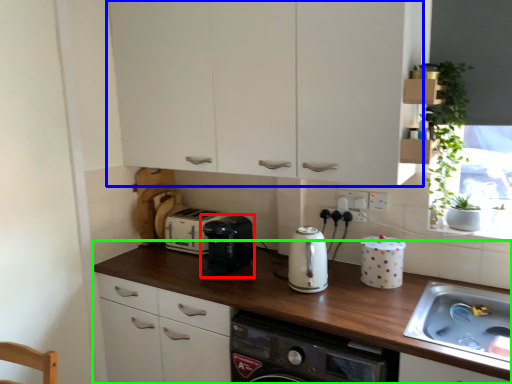
Question: Based on their relative distances, which object is nearer to kitchen appliance (highlighted by a red box)? Choose from cabinetry (highlighted by a blue box) and countertop (highlighted by a green box).

Choices:
 (A) cabinetry
 (B) countertop

Answer: (B)